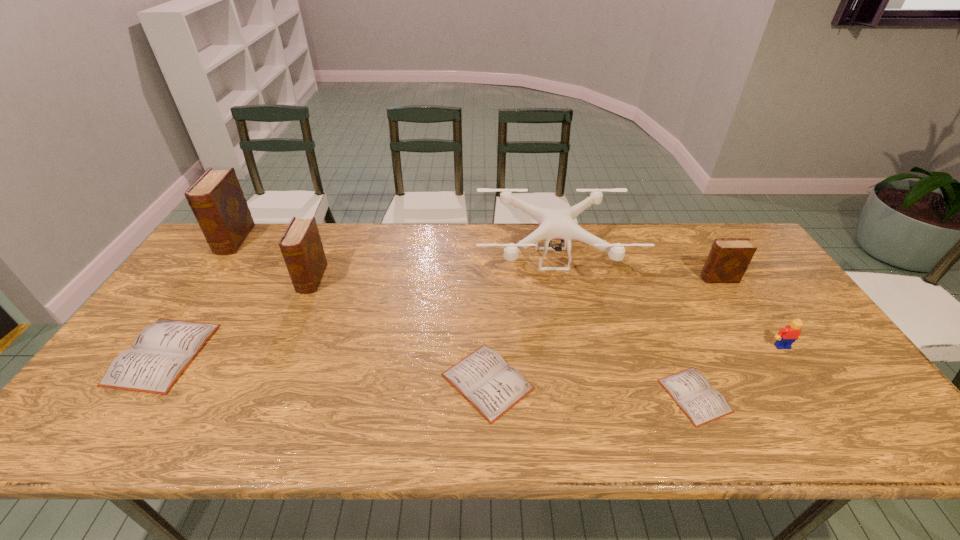
I want to click on the leftmost brown diary, so click(217, 201).

At what (x,y) coordinates should I click in order to perform the action: click on the farthest brown diary. Please return your answer as a coordinate pair (x, y). Looking at the image, I should click on tap(217, 201).

Where is `the second tallest diary`? The height and width of the screenshot is (540, 960). the second tallest diary is located at coordinates tap(301, 246).

You are a GUI agent. You are given a task and a screenshot of the screen. Output one action in this format:
    pyautogui.click(x=<x>, y=<y>)
    Task: Click on the fourth diary from right to left
    Image resolution: width=960 pixels, height=540 pixels.
    Given the screenshot: What is the action you would take?
    pyautogui.click(x=301, y=246)

At what (x,y) coordinates should I click in order to perform the action: click on drone. Please return your answer as a coordinate pair (x, y). Looking at the image, I should click on (554, 224).

Locate an element on the screen. This screenshot has width=960, height=540. the fourth tallest object is located at coordinates (728, 259).

Where is `the smallest brown diary`? The height and width of the screenshot is (540, 960). the smallest brown diary is located at coordinates (728, 259).

The height and width of the screenshot is (540, 960). Identify the location of the fifth tallest object. (786, 336).

At what (x,y) coordinates should I click in order to perform the action: click on the biggest white diary. Please return your answer as a coordinate pair (x, y). This screenshot has width=960, height=540. Looking at the image, I should click on (160, 353).

Where is `the fourth tallest diary`? Image resolution: width=960 pixels, height=540 pixels. the fourth tallest diary is located at coordinates (160, 353).